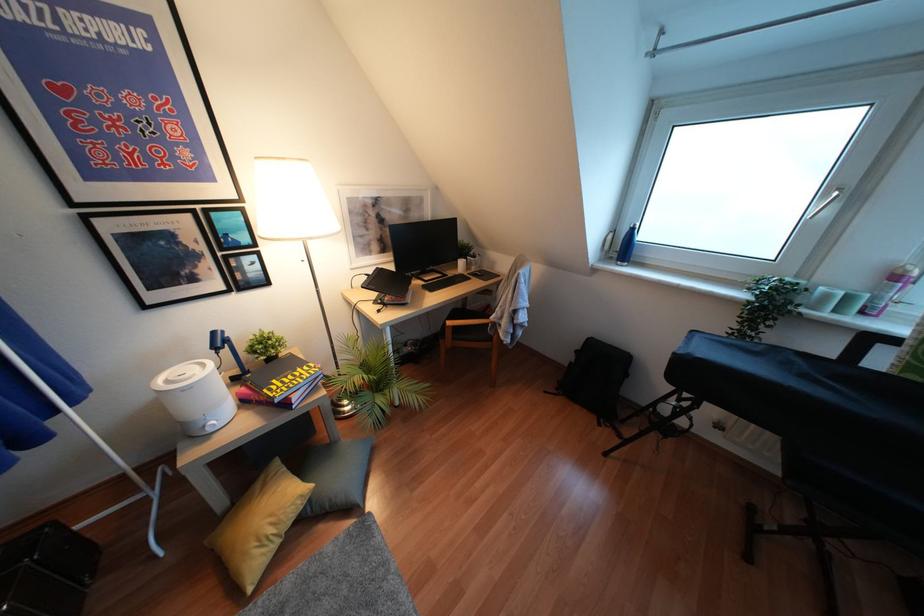
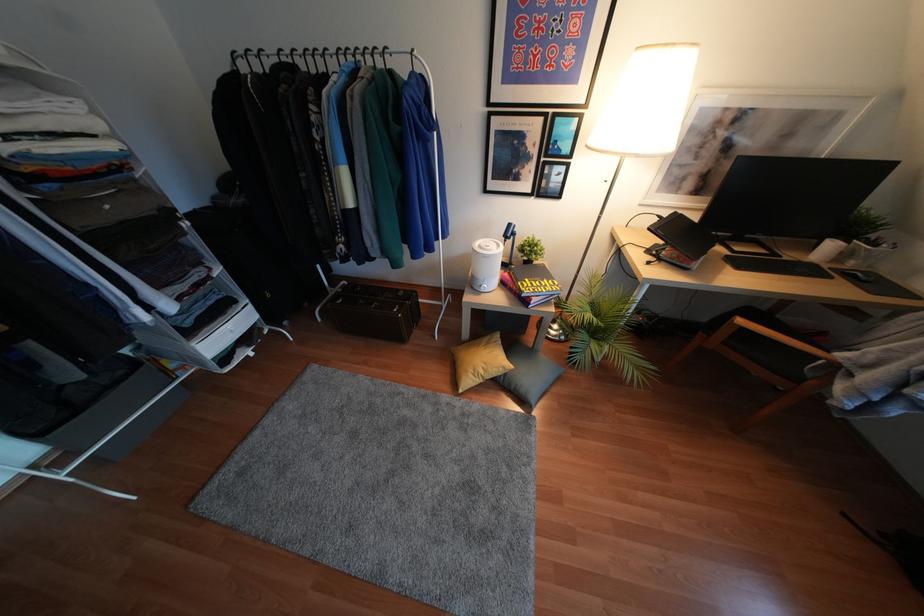
Where in the second image is the point corresponding to point 271,530 from the first image?

(480, 371)